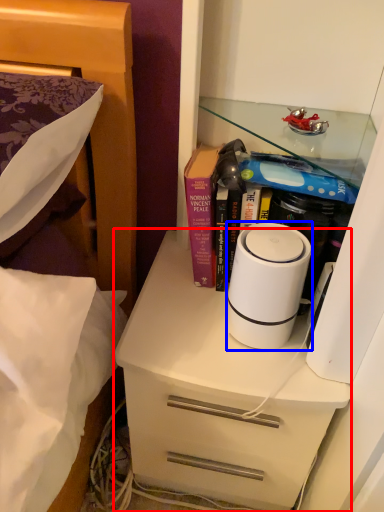
Question: Which of the following is the farthest to the observer, chest of drawers (highlighted by a red box) or home appliance (highlighted by a blue box)?

Choices:
 (A) chest of drawers
 (B) home appliance

Answer: (A)